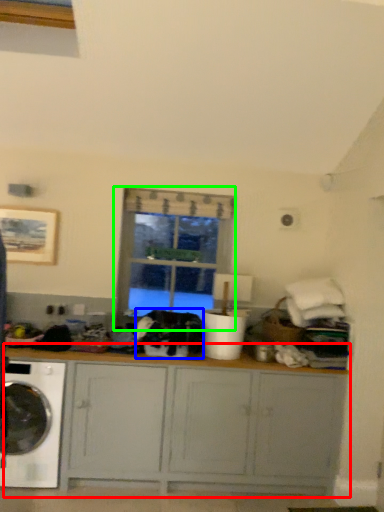
Question: Which is farther away from cabinetry (highlighted by a red box)? clothing (highlighted by a blue box) or window (highlighted by a green box)?

Choices:
 (A) clothing
 (B) window

Answer: (B)